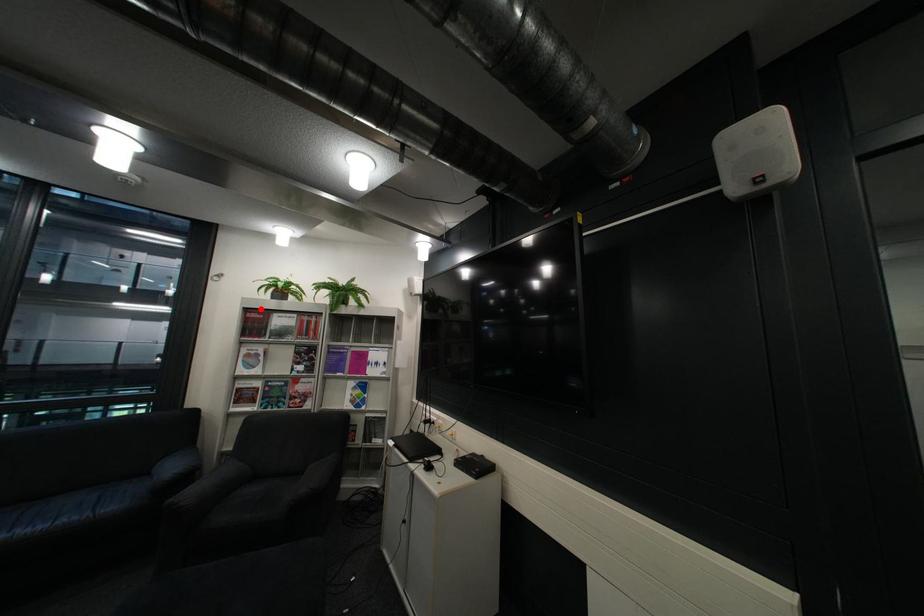
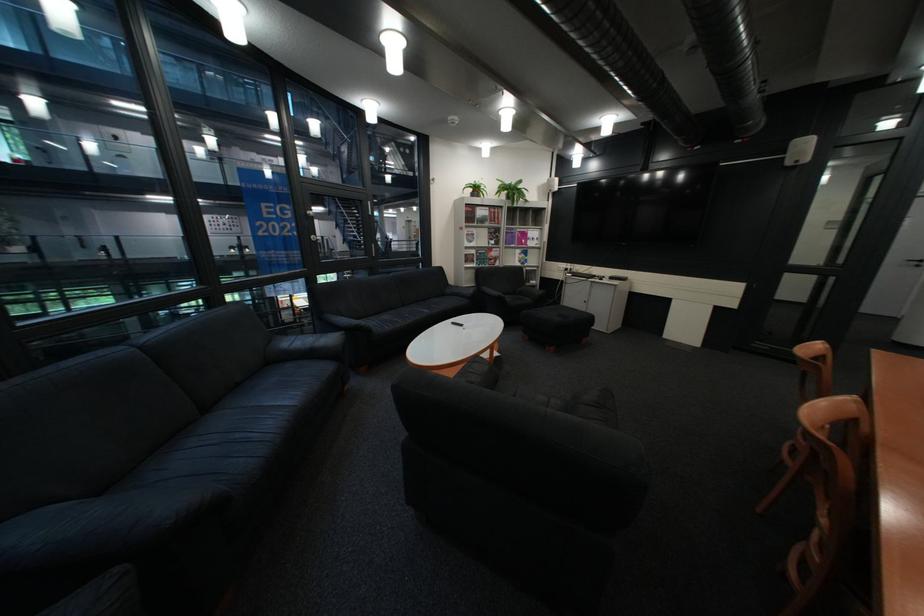
Question: I am providing you with two images of the same scene from different viewpoints. A red point is shown in image1. For the corresponding object point in image2, is it positioned nearer or farther from the camera?

Choices:
 (A) Nearer
 (B) Farther

Answer: (A)